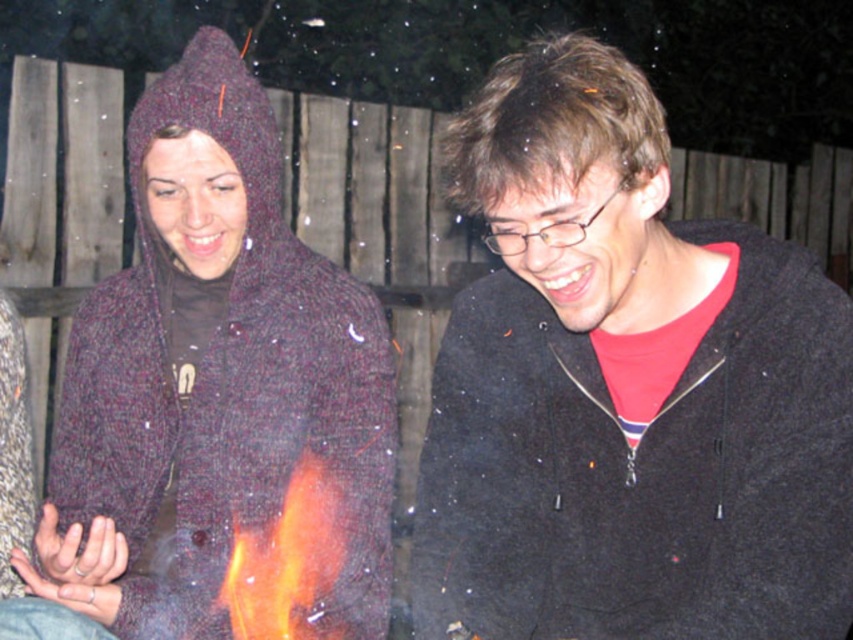
Question: Can you confirm if black matte jacket at center is positioned below knitted woolen sweater at left?

Choices:
 (A) no
 (B) yes

Answer: (B)

Question: Among these points, which one is farthest from the camera?

Choices:
 (A) (241, 616)
 (B) (839, 369)
 (C) (305, 536)

Answer: (C)

Question: Does knitted woolen sweater at left have a lesser width compared to flamematerial/texture at center?

Choices:
 (A) yes
 (B) no

Answer: (B)

Question: Which object is farther from the camera taking this photo?

Choices:
 (A) black matte jacket at center
 (B) flamematerial/texture at center

Answer: (B)

Question: Which point is farther from the camera taking this photo?

Choices:
 (A) (302, 454)
 (B) (119, 609)

Answer: (A)

Question: In this image, where is black matte jacket at center located relative to flamematerial/texture at center?

Choices:
 (A) right
 (B) left

Answer: (A)